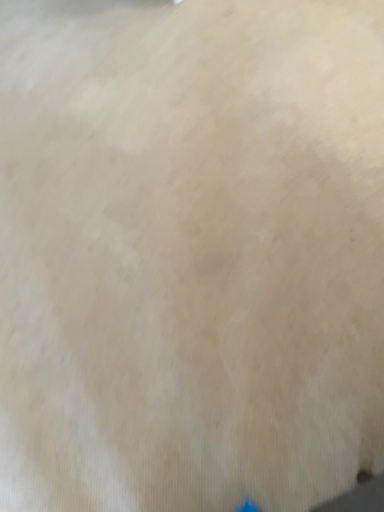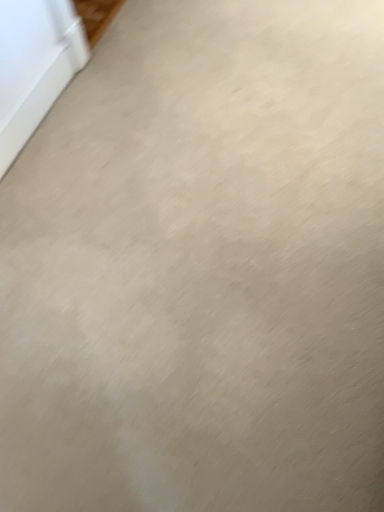
Question: How did the camera likely rotate when shooting the video?

Choices:
 (A) rotated right
 (B) rotated left

Answer: (A)